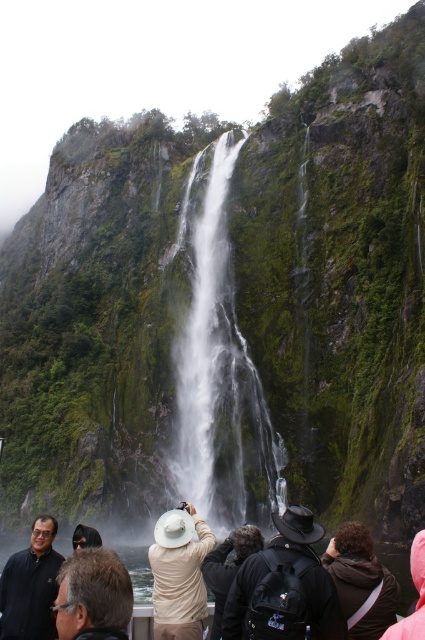
Question: Estimate the real-world distances between objects in this image. Which object is closer to the brown hair at lower left?

Choices:
 (A) dark blue suit at center
 (B) pink fabric at lower right
 (C) dark brown leather jacket at lower center
 (D) black fabric backpack at center

Answer: (A)

Question: Which object is farther from the camera taking this photo?

Choices:
 (A) dark brown leather jacket at lower center
 (B) beige fabric hat at center

Answer: (B)

Question: Is the position of beige fabric hat at center less distant than that of pink fabric at lower right?

Choices:
 (A) no
 (B) yes

Answer: (A)

Question: From the image, what is the correct spatial relationship of white smooth waterfall at center in relation to dark brown leather jacket at lower center?

Choices:
 (A) above
 (B) below

Answer: (A)

Question: Which point appears farthest from the camera in this image?

Choices:
 (A) (419, 554)
 (B) (90, 611)
 (C) (158, 552)

Answer: (C)

Question: Does beige fabric hat at center have a greater width compared to pink fabric at lower right?

Choices:
 (A) yes
 (B) no

Answer: (B)